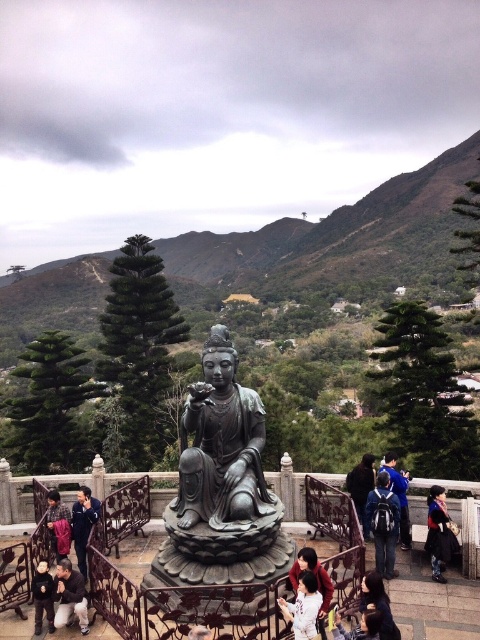
Question: Can you confirm if dark blue jacket at lower left is positioned above camouflage jacket at lower left?

Choices:
 (A) yes
 (B) no

Answer: (B)

Question: Which point is closer to the camera taking this photo?

Choices:
 (A) (370, 470)
 (B) (64, 589)
 (C) (371, 524)

Answer: (B)

Question: Which point is closer to the camera?

Choices:
 (A) matte pink shirt at lower center
 (B) blue fabric backpack at center
 (C) dark blue jacket at lower left

Answer: (A)

Question: Which object is closer to the camera taking this photo?

Choices:
 (A) dark blue fabric at lower right
 (B) dark gray stone statue at lower center
 (C) dark gray stone statue at center
 (D) bronze statue at center

Answer: (B)

Question: Is dark blue fabric at lower right to the right of dark gray stone statue at center from the viewer's perspective?

Choices:
 (A) no
 (B) yes

Answer: (B)

Question: Is white fabric at center bigger than matte pink shirt at lower center?

Choices:
 (A) no
 (B) yes

Answer: (A)